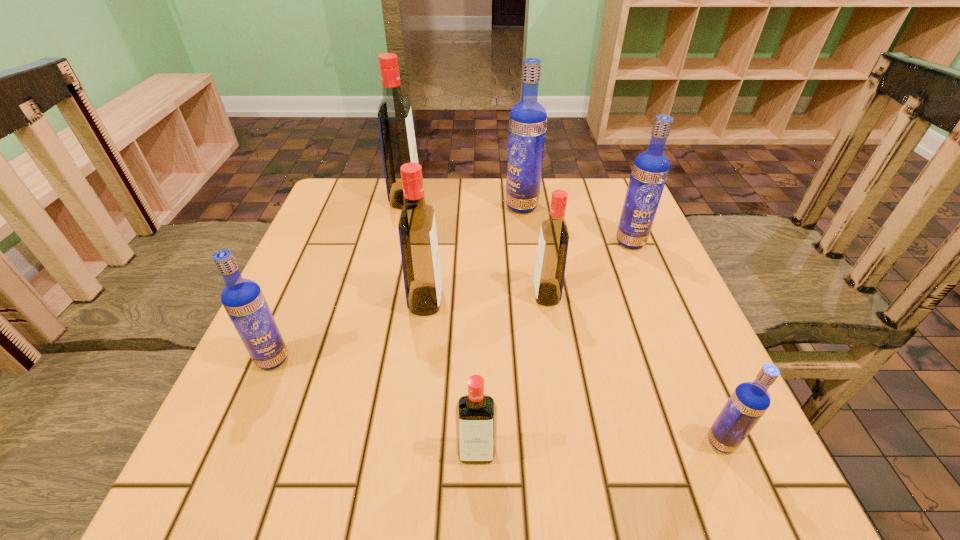
Identify the location of free location located on the front and back of the rightmost red vodka. Image resolution: width=960 pixels, height=540 pixels. (369, 294).

The height and width of the screenshot is (540, 960). Identify the location of free region located 0.080m on the front and back of the rightmost red vodka. (495, 294).

Where is `vacant space located on the back of the nearest blue vodka`? vacant space located on the back of the nearest blue vodka is located at coordinates (676, 335).

You are a GUI agent. You are given a task and a screenshot of the screen. Output one action in this format:
    pyautogui.click(x=<x>, y=<y>)
    Task: Click on the vacant space located 0.050m on the front and back of the smallest red vodka
    This screenshot has width=960, height=540.
    Given the screenshot: What is the action you would take?
    pyautogui.click(x=476, y=501)

Locate an element on the screen. object that is at the left edge is located at coordinates (243, 299).

Where is `object at the near right corner`? object at the near right corner is located at coordinates (749, 401).

Image resolution: width=960 pixels, height=540 pixels. In order to click on vacant area at the far edge in this screenshot , I will do `click(387, 218)`.

Identify the location of vacant space at the near edge of the desktop. The width and height of the screenshot is (960, 540). (377, 505).

You are a GUI agent. You are given a task and a screenshot of the screen. Output one action in this format:
    pyautogui.click(x=<x>, y=<y>)
    Task: Click on the vacant area at the left edge of the desktop
    Image resolution: width=960 pixels, height=540 pixels.
    Given the screenshot: What is the action you would take?
    pyautogui.click(x=360, y=262)

The width and height of the screenshot is (960, 540). I want to click on free region at the right edge, so click(650, 250).